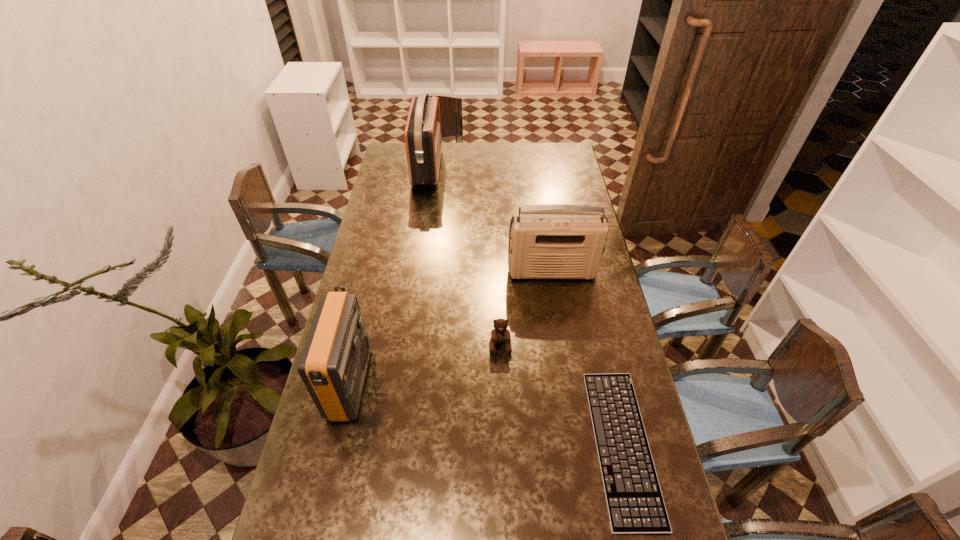
Locate an element on the screen. The image size is (960, 540). free spot that satisfies the following two spatial constraints: 1. on the front-facing side of the shortest object; 2. on the right side of the farthest radio receiver is located at coordinates (385, 445).

What are the coordinates of `free region that satisfies the following two spatial constraints: 1. on the front-facing side of the fourth object from right to left; 2. on the back side of the computer keyboard` in the screenshot? It's located at pyautogui.click(x=385, y=445).